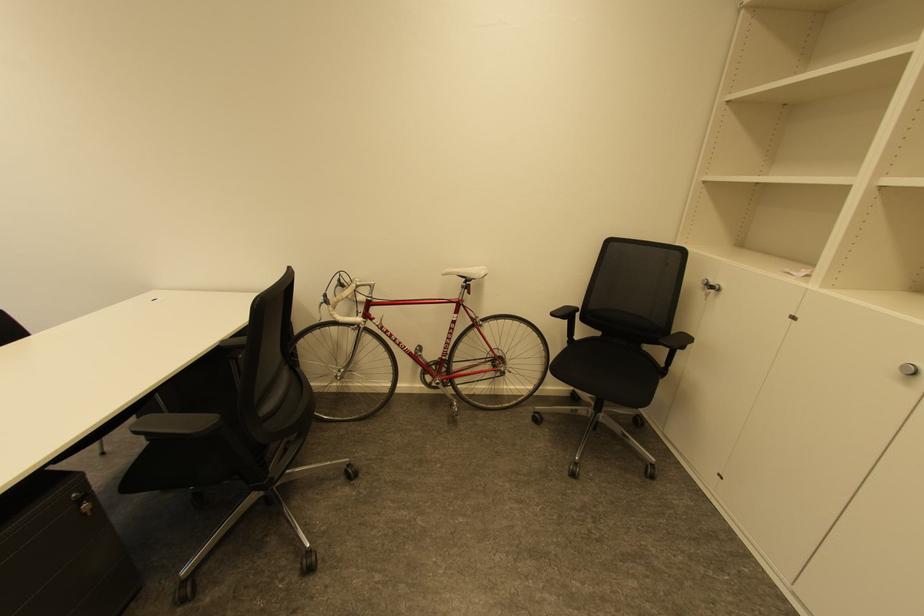
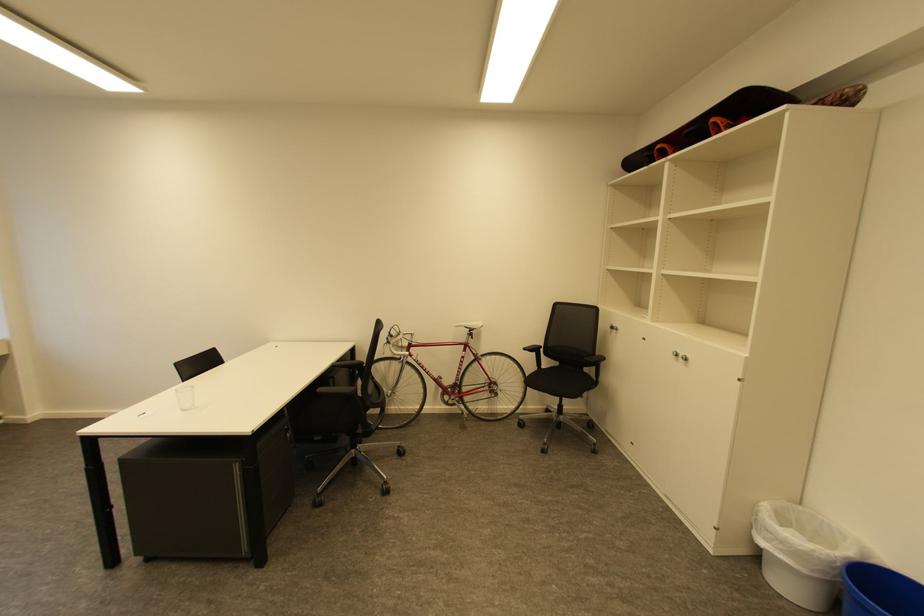
Question: I am providing you with two images of the same scene from different viewpoints. Which of the following objects are not visible in image2?

Choices:
 (A) black chair armrest
 (B) blue bucket
 (C) silver cabinet knob
 (D) none of these

Answer: (D)